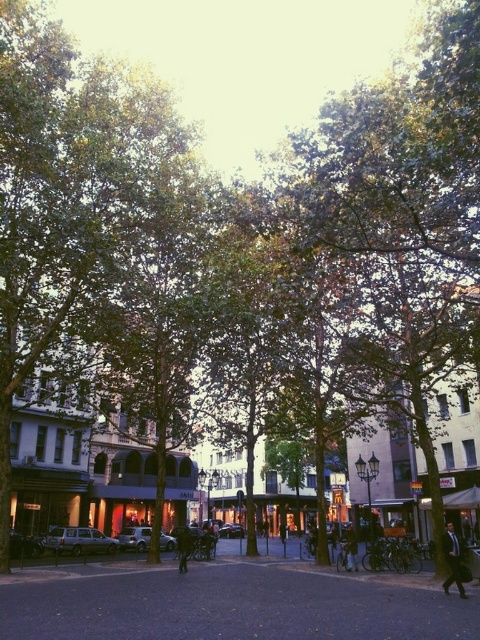
Question: Is dark suit at center bigger than dark blue jeans at center?

Choices:
 (A) yes
 (B) no

Answer: (A)

Question: Is dark suit at center thinner than dark brown leather jacket at center?

Choices:
 (A) no
 (B) yes

Answer: (A)

Question: Which point is closer to the camera?

Choices:
 (A) (457, 586)
 (B) (189, 529)
 (C) (350, 541)

Answer: (A)

Question: Estimate the real-world distances between objects in this image. Which object is farther from the dark brown leather jacket at center?

Choices:
 (A) dark suit at center
 (B) dark blue jeans at center

Answer: (A)

Question: Can you confirm if dark blue jeans at center is bigger than dark brown leather jacket at center?

Choices:
 (A) yes
 (B) no

Answer: (A)

Question: Which object appears farthest from the camera in this image?

Choices:
 (A) dark brown leather jacket at center
 (B) dark suit at center
 (C) dark blue jeans at center

Answer: (C)